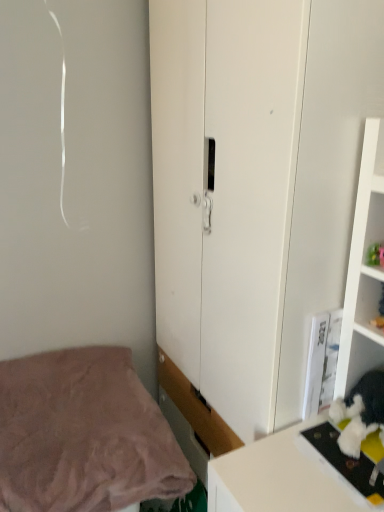
At what (x,y) coordinates should I click in order to perform the action: click on pink soft fabric bed at lower left. Please return your answer as a coordinate pair (x, y). Looking at the image, I should click on (83, 434).

Describe the element at coordinates (83, 434) in the screenshot. I see `pink soft fabric bed at lower left` at that location.

Identify the location of white matte cupboard at center. The height and width of the screenshot is (512, 384). (256, 186).

The width and height of the screenshot is (384, 512). Describe the element at coordinates (256, 186) in the screenshot. I see `white matte cupboard at center` at that location.

Find the location of a particular element. pink soft fabric bed at lower left is located at coordinates (83, 434).

Considering the positions of objects pink soft fabric bed at lower left and white matte cupboard at center in the image provided, who is more to the right, pink soft fabric bed at lower left or white matte cupboard at center?

white matte cupboard at center is more to the right.

In the scene shown: Is pink soft fabric bed at lower left in front of or behind white matte cupboard at center in the image?

Clearly, pink soft fabric bed at lower left is behind white matte cupboard at center.

Considering the points (140, 477) and (299, 290), which point is in front, point (140, 477) or point (299, 290)?

Point (299, 290)

From the image's perspective, is pink soft fabric bed at lower left under white matte cupboard at center?

Yes.

From a real-world perspective, which is physically below, pink soft fabric bed at lower left or white matte cupboard at center?

From a 3D spatial view, pink soft fabric bed at lower left is below.

Considering the relative sizes of pink soft fabric bed at lower left and white matte cupboard at center in the image provided, is pink soft fabric bed at lower left thinner than white matte cupboard at center?

In fact, pink soft fabric bed at lower left might be wider than white matte cupboard at center.

Which of these two, pink soft fabric bed at lower left or white matte cupboard at center, stands taller?

With more height is white matte cupboard at center.

Based on their sizes in the image, would you say pink soft fabric bed at lower left is bigger or smaller than white matte cupboard at center?

In the image, pink soft fabric bed at lower left appears to be smaller than white matte cupboard at center.

Is white matte cupboard at center inside pink soft fabric bed at lower left?

That's incorrect, white matte cupboard at center is not inside pink soft fabric bed at lower left.

Is pink soft fabric bed at lower left next to white matte cupboard at center?

No, pink soft fabric bed at lower left is not making contact with white matte cupboard at center.

Is pink soft fabric bed at lower left oriented towards white matte cupboard at center?

No, pink soft fabric bed at lower left is not turned towards white matte cupboard at center.

Can you tell me how much pink soft fabric bed at lower left and white matte cupboard at center differ in facing direction?

pink soft fabric bed at lower left and white matte cupboard at center are facing 90.1 degrees away from each other.

This screenshot has height=512, width=384. Find the location of `cupboard that appears above the pink soft fabric bed at lower left (from the image's perspective)`. cupboard that appears above the pink soft fabric bed at lower left (from the image's perspective) is located at coordinates (256, 186).

Is white matte cupboard at center to the left of pink soft fabric bed at lower left from the viewer's perspective?

Incorrect, white matte cupboard at center is not on the left side of pink soft fabric bed at lower left.

Between white matte cupboard at center and pink soft fabric bed at lower left, which one is positioned behind?

pink soft fabric bed at lower left is behind.

Is point (272, 428) less distant than point (60, 350)?

Yes, it is in front of point (60, 350).

From the image's perspective, which one is positioned higher, white matte cupboard at center or pink soft fabric bed at lower left?

white matte cupboard at center appears higher in the image.

From a real-world perspective, is white matte cupboard at center under pink soft fabric bed at lower left?

Incorrect, from a real-world perspective, white matte cupboard at center is higher than pink soft fabric bed at lower left.

Considering the relative sizes of white matte cupboard at center and pink soft fabric bed at lower left in the image provided, is white matte cupboard at center thinner than pink soft fabric bed at lower left?

Yes.

Considering the sizes of objects white matte cupboard at center and pink soft fabric bed at lower left in the image provided, who is shorter, white matte cupboard at center or pink soft fabric bed at lower left?

Standing shorter between the two is pink soft fabric bed at lower left.

Does white matte cupboard at center have a larger size compared to pink soft fabric bed at lower left?

Yes, white matte cupboard at center is bigger than pink soft fabric bed at lower left.

Is white matte cupboard at center inside or outside of pink soft fabric bed at lower left?

white matte cupboard at center cannot be found inside pink soft fabric bed at lower left.

Is white matte cupboard at center beside pink soft fabric bed at lower left?

white matte cupboard at center is not next to pink soft fabric bed at lower left, and they're not touching.

Is pink soft fabric bed at lower left at the back of white matte cupboard at center?

Yes, pink soft fabric bed at lower left is at the back of white matte cupboard at center.

What's the angular difference between white matte cupboard at center and pink soft fabric bed at lower left's facing directions?

90.1 degrees separate the facing orientations of white matte cupboard at center and pink soft fabric bed at lower left.

Measure the distance between white matte cupboard at center and pink soft fabric bed at lower left.

white matte cupboard at center and pink soft fabric bed at lower left are 49.76 centimeters apart from each other.

This screenshot has height=512, width=384. In order to click on bed behind the white matte cupboard at center in this screenshot , I will do coord(83,434).

The image size is (384, 512). I want to click on bed behind the white matte cupboard at center, so click(x=83, y=434).

Where is `cupboard that is on the right side of pink soft fabric bed at lower left`? This screenshot has height=512, width=384. cupboard that is on the right side of pink soft fabric bed at lower left is located at coordinates (256, 186).